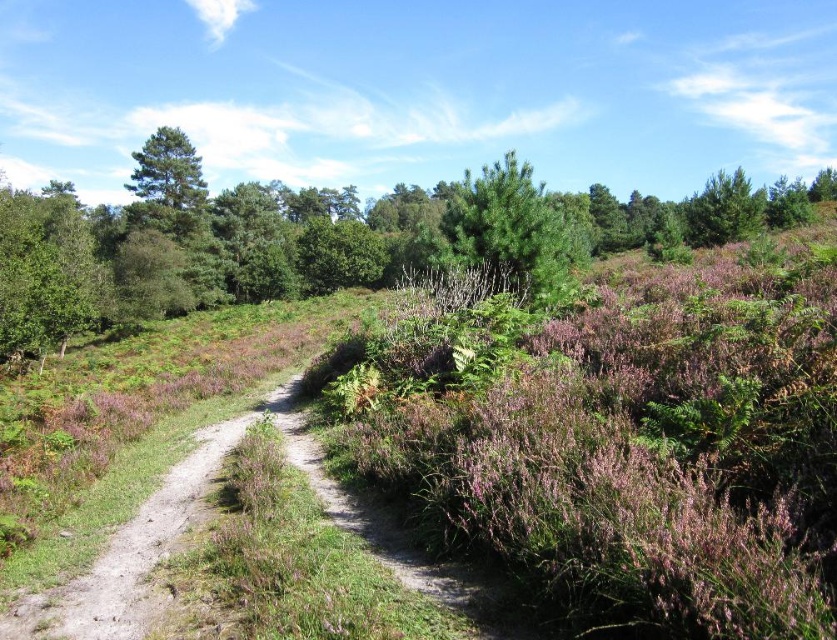
Question: Among these points, which one is farthest from the camera?

Choices:
 (A) (452, 195)
 (B) (86, 262)

Answer: (A)

Question: Among these points, which one is farthest from the camera?

Choices:
 (A) (59, 298)
 (B) (512, 218)

Answer: (A)

Question: Is green leafy tree at left to the left of green matte tree at center from the viewer's perspective?

Choices:
 (A) yes
 (B) no

Answer: (A)

Question: Is green leafy tree at left closer to the viewer compared to green matte tree at center?

Choices:
 (A) no
 (B) yes

Answer: (A)

Question: Can you confirm if green leafy tree at left is positioned to the left of green matte tree at center?

Choices:
 (A) yes
 (B) no

Answer: (A)